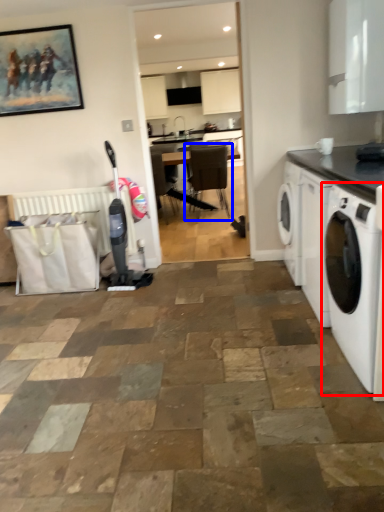
Question: Which object is closer to the camera taking this photo, washing machine (highlighted by a red box) or chair (highlighted by a blue box)?

Choices:
 (A) washing machine
 (B) chair

Answer: (A)